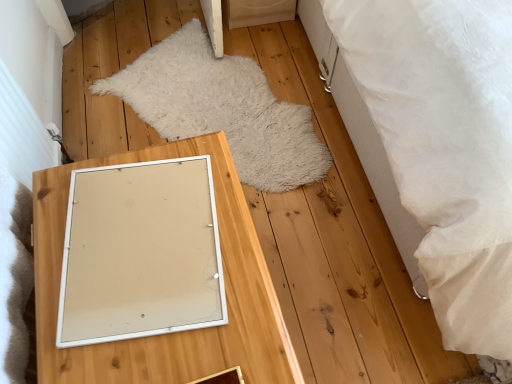
You are a GUI agent. You are given a task and a screenshot of the screen. Output one action in this format:
    pyautogui.click(x=<x>, y=<y>)
    Task: Click on the free location above white matte picture frame at center (from a real-world perspective)
    This screenshot has height=384, width=512.
    Given the screenshot: What is the action you would take?
    pyautogui.click(x=137, y=232)